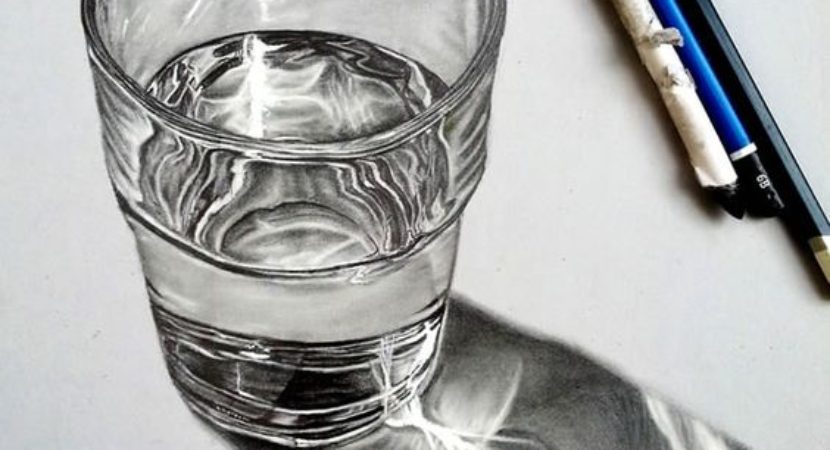
This screenshot has height=450, width=830. What are the coordinates of `pen` in the screenshot? It's located at pyautogui.click(x=710, y=163).